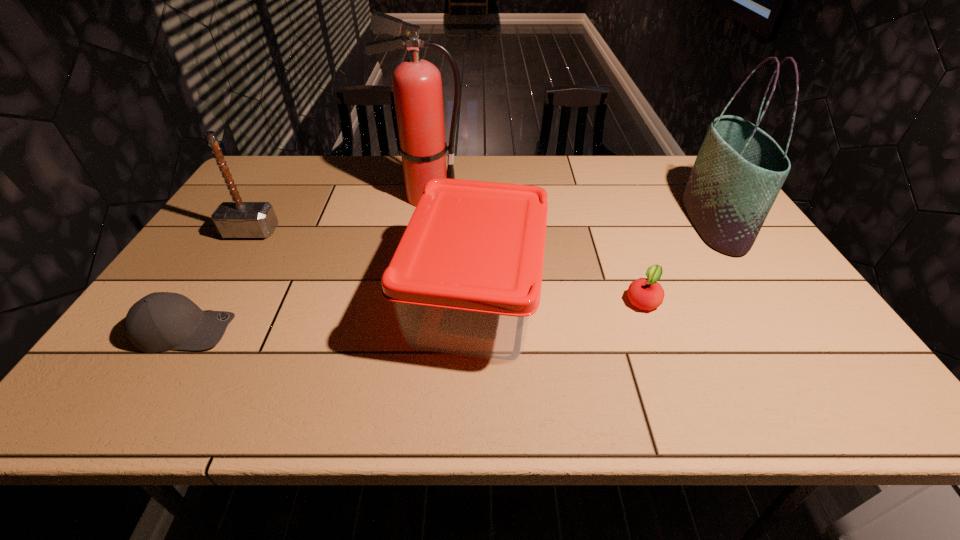
In the image, there is a desktop. At what (x,y) coordinates should I click in order to perform the action: click on vacant space at the left edge. Please return your answer as a coordinate pair (x, y). The height and width of the screenshot is (540, 960). Looking at the image, I should click on (245, 248).

Where is `vacant area at the right edge of the desktop`? vacant area at the right edge of the desktop is located at coordinates (728, 275).

At what (x,y) coordinates should I click in order to perform the action: click on blank space at the far left corner of the desktop. Please return your answer as a coordinate pair (x, y). The height and width of the screenshot is (540, 960). Looking at the image, I should click on (271, 156).

Locate an element on the screen. free space between the tray and the rightmost object is located at coordinates (594, 261).

Locate an element on the screen. free area in between the fifth object from left to right and the tray is located at coordinates (559, 300).

Image resolution: width=960 pixels, height=540 pixels. What are the coordinates of `free space between the tote bag and the apple` in the screenshot? It's located at (678, 261).

Locate an element on the screen. The image size is (960, 540). blank region between the fire extinguisher and the third tallest object is located at coordinates (339, 214).

Locate which object is the third closest to the shortest object. Please provide its 2D coordinates. Your answer should be formatted as a tuple, i.e. [(x, y)], where the tuple contains the x and y coordinates of a point satisfying the conditions above.

[(417, 86)]

Locate an element on the screen. Image resolution: width=960 pixels, height=540 pixels. the closest object to the fire extinguisher is located at coordinates (466, 277).

Where is `blank space that satisfies the following two spatial constraints: 1. on the striking surface of the third shortest object; 2. on the left side of the hammer`? The image size is (960, 540). blank space that satisfies the following two spatial constraints: 1. on the striking surface of the third shortest object; 2. on the left side of the hammer is located at coordinates (209, 300).